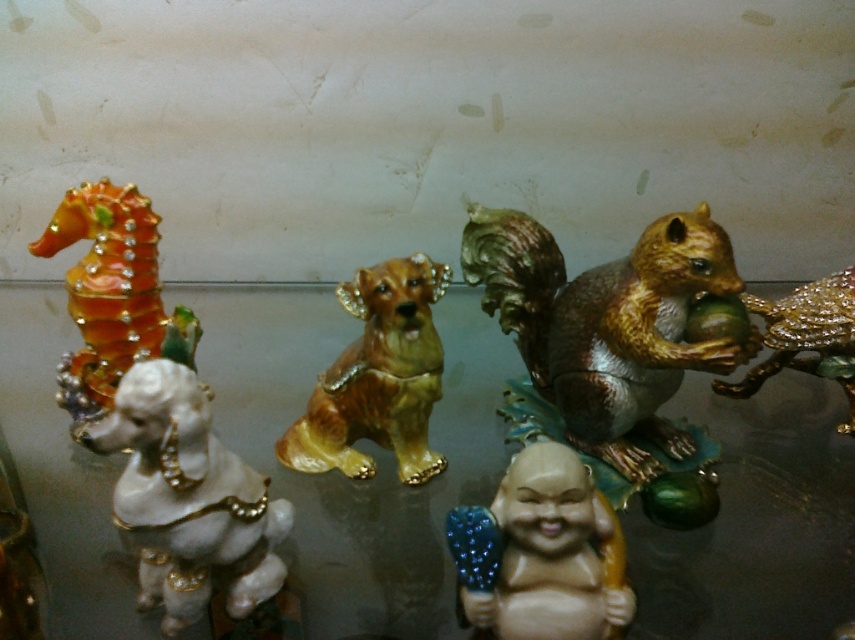
Question: Which object appears closest to the camera in this image?

Choices:
 (A) white glossy dog at left
 (B) shiny gold squirrel at center
 (C) shiny gold squirrel at center-right

Answer: (A)

Question: Can you confirm if shiny gold squirrel at center-right is smaller than shiny orange seahorse at left?

Choices:
 (A) yes
 (B) no

Answer: (A)

Question: Considering the real-world distances, which object is closest to the shiny gold squirrel at center-right?

Choices:
 (A) shiny gold squirrel at center
 (B) white glossy dog at left
 (C) porcelain beige figure at center

Answer: (A)

Question: Which object is closer to the camera taking this photo?

Choices:
 (A) shiny gold squirrel at center
 (B) shiny orange seahorse at left
 (C) white glossy dog at left
 (D) porcelain beige figure at center

Answer: (D)

Question: Is porcelain beige figure at center in front of shiny gold squirrel at center?

Choices:
 (A) yes
 (B) no

Answer: (A)

Question: Can you confirm if white glossy poodle at left is smaller than shiny gold squirrel at center-right?

Choices:
 (A) yes
 (B) no

Answer: (B)